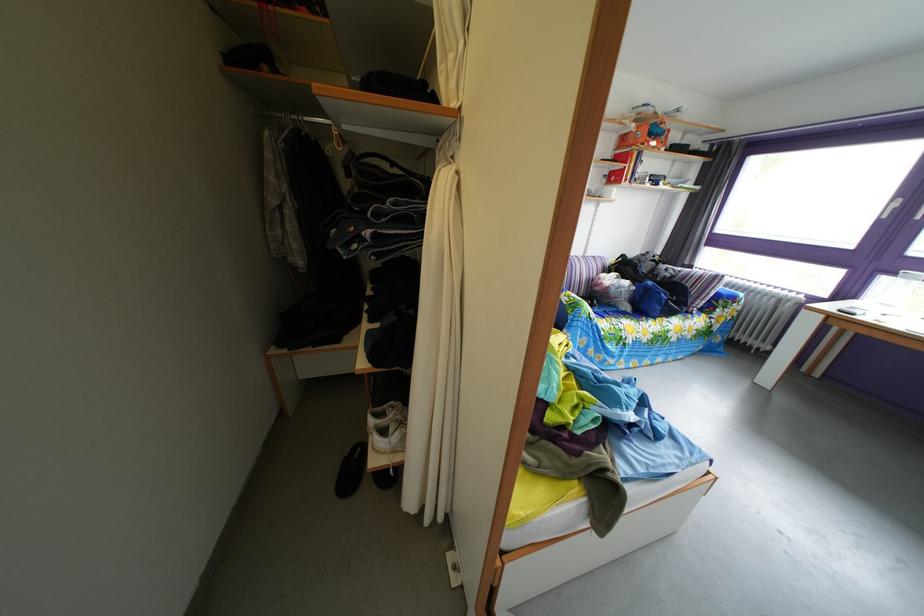
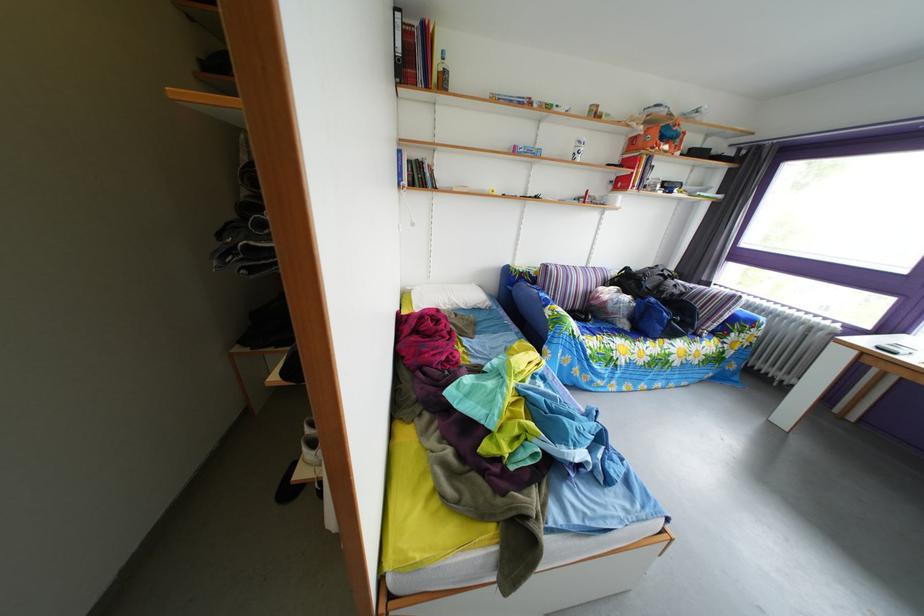
In the second image, find the point that corresponds to point (661, 291) in the first image.

(663, 307)